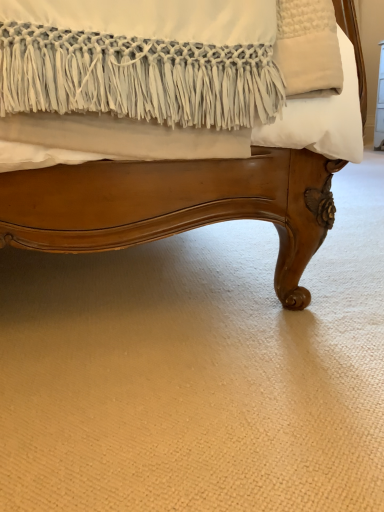
Describe the element at coordinates (308, 48) in the screenshot. I see `beige soft pillow at upper right` at that location.

What are the coordinates of `beige soft pillow at upper right` in the screenshot? It's located at (308, 48).

The height and width of the screenshot is (512, 384). I want to click on beige soft pillow at upper right, so click(308, 48).